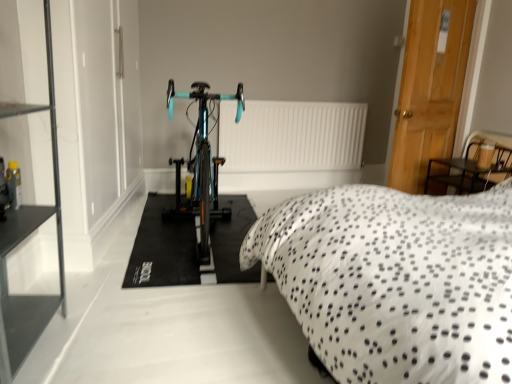
Question: Do you think teal glossy bicycle at center is within white matte radiator at center, or outside of it?

Choices:
 (A) outside
 (B) inside

Answer: (A)

Question: From a real-world perspective, is teal glossy bicycle at center physically located above or below white matte radiator at center?

Choices:
 (A) above
 (B) below

Answer: (A)

Question: Which object is the closest to the wooden door at right?

Choices:
 (A) teal glossy bicycle at center
 (B) white matte radiator at center
 (C) white dotted fabric at center
 (D) teal glossy bicycle at center
 (E) black glass shelf at left

Answer: (B)

Question: Which object is the farthest from the teal glossy bicycle at center?

Choices:
 (A) white matte radiator at center
 (B) white dotted fabric at center
 (C) teal glossy bicycle at center
 (D) black glass shelf at left
 (E) wooden door at right

Answer: (E)